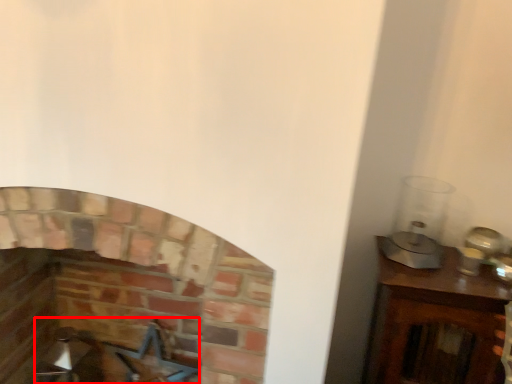
Question: From the image's perspective, what is the correct spatial relationship of swivel chair (annotated by the red box) in relation to fireplace?

Choices:
 (A) above
 (B) below

Answer: (B)